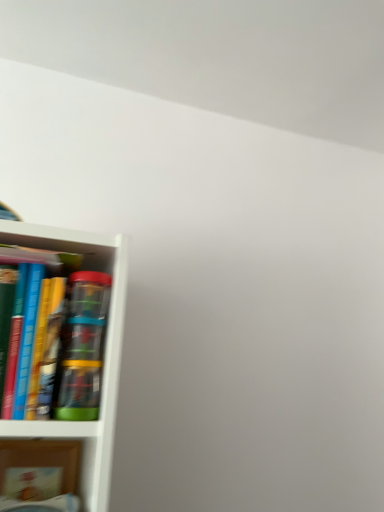
Question: Is point (34, 441) positioned closer to the camera than point (18, 245)?

Choices:
 (A) farther
 (B) closer

Answer: (A)

Question: Would you say matte cardboard book at lower left, which is the second book from top to bottom, is to the left or to the right of hardcover book at left, which is the second book in bottom-to-top order, in the picture?

Choices:
 (A) left
 (B) right

Answer: (A)

Question: From their relative heights in the image, would you say matte cardboard book at lower left, which is the second book from top to bottom, is taller or shorter than hardcover book at left, which is the second book in bottom-to-top order?

Choices:
 (A) tall
 (B) short

Answer: (B)

Question: Is hardcover book at left, which is the second book in bottom-to-top order, wider or thinner than matte cardboard book at lower left, which is the second book from top to bottom?

Choices:
 (A) wide
 (B) thin

Answer: (A)

Question: In terms of height, does hardcover book at left, which is the second book in bottom-to-top order, look taller or shorter compared to matte cardboard book at lower left, positioned as the first book in bottom-to-top order?

Choices:
 (A) short
 (B) tall

Answer: (B)

Question: From a real-world perspective, relative to matte cardboard book at lower left, which is the second book from top to bottom, is hardcover book at left, which is the second book in bottom-to-top order, vertically above or below?

Choices:
 (A) above
 (B) below

Answer: (A)

Question: Relative to matte cardboard book at lower left, which is the second book from top to bottom, is hardcover book at left, which is the second book in bottom-to-top order, in front or behind?

Choices:
 (A) behind
 (B) front

Answer: (B)